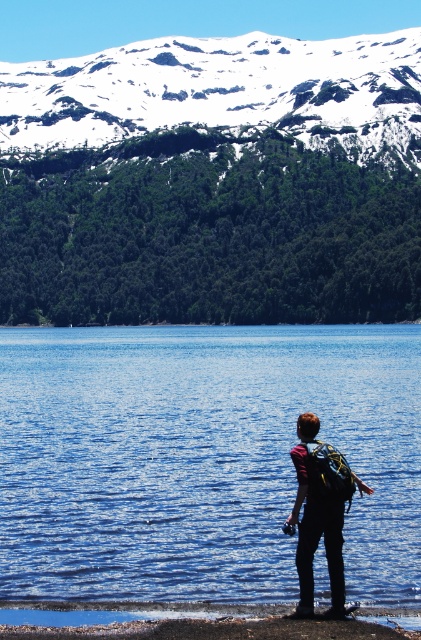
Question: Estimate the real-world distances between objects in this image. Which object is closer to the blue liquid water at lower center?

Choices:
 (A) snowy rock mountain at upper center
 (B) matte black backpack at center
 (C) smooth sand shoreline at lower center

Answer: (B)

Question: Does blue liquid water at lower center appear on the left side of snowy rock mountain at upper center?

Choices:
 (A) no
 (B) yes

Answer: (A)

Question: Estimate the real-world distances between objects in this image. Which object is farther from the matte black backpack at center?

Choices:
 (A) snowy rock mountain at upper center
 (B) smooth sand shoreline at lower center
 (C) blue liquid water at lower center

Answer: (A)

Question: Is blue liquid water at lower center to the left of snowy rock mountain at upper center from the viewer's perspective?

Choices:
 (A) yes
 (B) no

Answer: (B)

Question: Which object is the closest to the smooth sand shoreline at lower center?

Choices:
 (A) matte black backpack at center
 (B) blue liquid water at lower center
 (C) snowy rock mountain at upper center

Answer: (A)

Question: Is blue liquid water at lower center closer to the viewer compared to smooth sand shoreline at lower center?

Choices:
 (A) no
 (B) yes

Answer: (A)